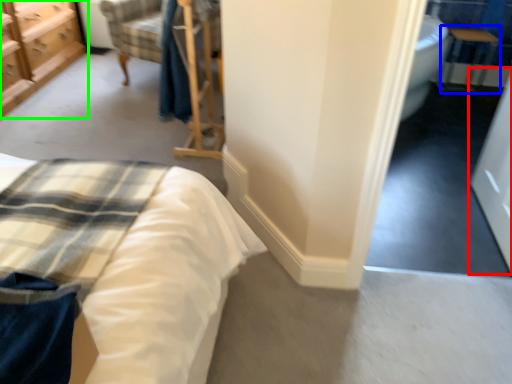
Question: Which is nearer to the screen door (highlighted by a red box)? table (highlighted by a blue box) or chest of drawers (highlighted by a green box).

Choices:
 (A) table
 (B) chest of drawers

Answer: (A)